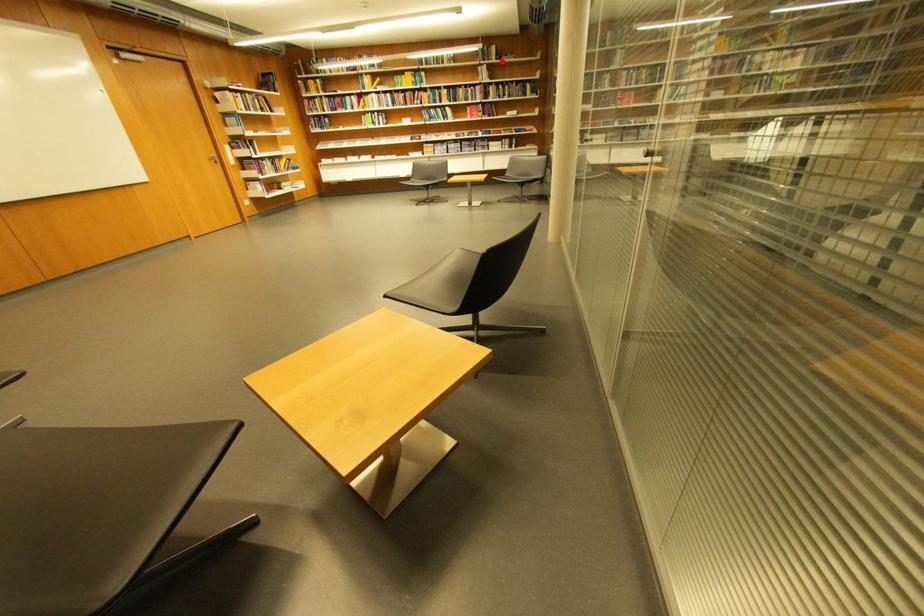
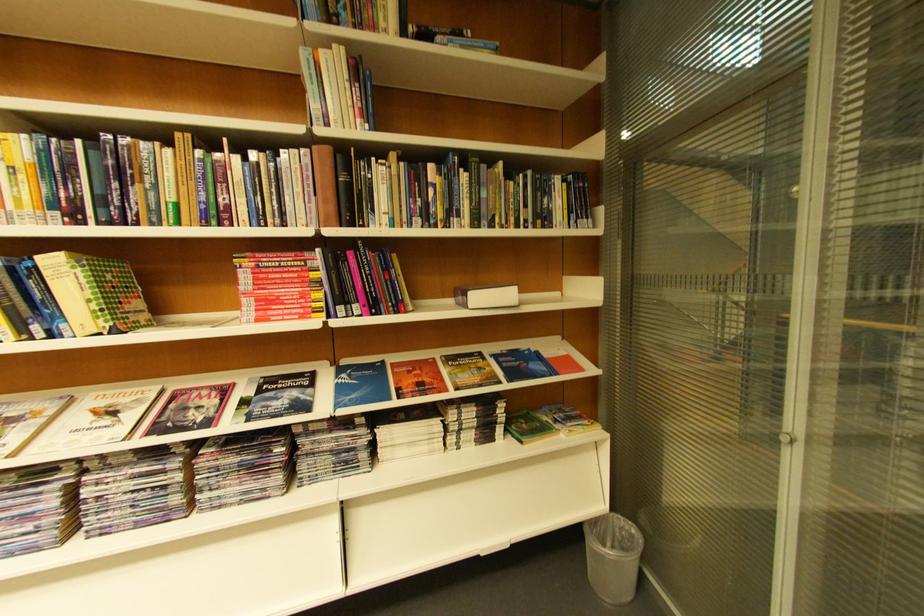
Question: I am providing you with two images of the same scene from different viewpoints. A red point is shown in image1. For the corresponding object point in image2, is it positioned nearer or farther from the camera?

Choices:
 (A) Nearer
 (B) Farther

Answer: (B)